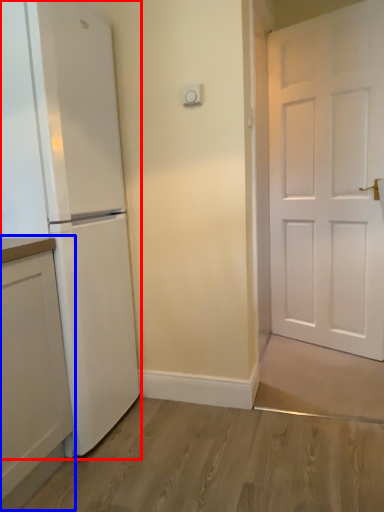
Question: Which object appears farthest to the camera in this image, refrigerator (highlighted by a red box) or cabinetry (highlighted by a blue box)?

Choices:
 (A) refrigerator
 (B) cabinetry

Answer: (A)